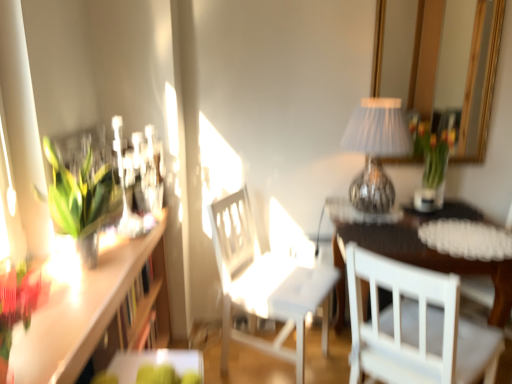
What do you see at coordinates (433, 149) in the screenshot? I see `translucent glass vase with tulips at upper right` at bounding box center [433, 149].

Locate an element on the screen. The height and width of the screenshot is (384, 512). white matte chair at center, the 2th chair in the right-to-left sequence is located at coordinates (265, 284).

In order to face silver pleated lampshade at upper right, should I rotate leftwards or rightwards?

It's best to rotate right around 15.654 degrees.

This screenshot has height=384, width=512. I want to click on wooden shelf at left, so click(91, 311).

The image size is (512, 384). What are the coordinates of `white wooden chair at lower right, the 2th chair viewed from the left` in the screenshot? It's located at pos(415,327).

Where is `translucent glass vase with tulips at upper right`? The height and width of the screenshot is (384, 512). translucent glass vase with tulips at upper right is located at coordinates (433, 149).

From the image's perspective, does white matte chair at center, the 2th chair in the right-to-left sequence, appear lower than green plastic tray at lower center, which is counted as the 2th table, starting from the right?

Actually, white matte chair at center, the 2th chair in the right-to-left sequence, appears above green plastic tray at lower center, which is counted as the 2th table, starting from the right, in the image.

Is white matte chair at center, arranged as the first chair when viewed from the left, aimed at green plastic tray at lower center, the first table positioned from the top?

No, white matte chair at center, arranged as the first chair when viewed from the left, is not facing towards green plastic tray at lower center, the first table positioned from the top.

Considering the sizes of objects white matte chair at center, the 2th chair in the right-to-left sequence, and green plastic tray at lower center, the first table when ordered from left to right, in the image provided, who is wider, white matte chair at center, the 2th chair in the right-to-left sequence, or green plastic tray at lower center, the first table when ordered from left to right,?

white matte chair at center, the 2th chair in the right-to-left sequence, is wider.

Starting from the white matte chair at center, the 2th chair in the right-to-left sequence, which table is the 2nd one in front? Please provide its 2D coordinates.

[(154, 368)]

Can you confirm if white matte chair at center, the 2th chair in the right-to-left sequence, is wider than white wooden chair at lower right, acting as the 1th chair starting from the right?

In fact, white matte chair at center, the 2th chair in the right-to-left sequence, might be narrower than white wooden chair at lower right, acting as the 1th chair starting from the right.

Which of these two, white matte chair at center, the 2th chair in the right-to-left sequence, or white wooden chair at lower right, the 2th chair viewed from the left, is bigger?

Bigger between the two is white matte chair at center, the 2th chair in the right-to-left sequence.

From the image's perspective, would you say white matte chair at center, the 2th chair in the right-to-left sequence, is positioned over white wooden chair at lower right, acting as the 1th chair starting from the right?

Yes, from the image's perspective, white matte chair at center, the 2th chair in the right-to-left sequence, is over white wooden chair at lower right, acting as the 1th chair starting from the right.

Is white matte chair at center, arranged as the first chair when viewed from the left, at the left side of white wooden chair at lower right, the 2th chair viewed from the left?

Yes, white matte chair at center, arranged as the first chair when viewed from the left, is to the left of white wooden chair at lower right, the 2th chair viewed from the left.

Is wooden table at center, the first table in the back-to-front sequence, spatially inside wooden shelf at left, or outside of it?

wooden table at center, the first table in the back-to-front sequence, lies outside wooden shelf at left.

How different are the orientations of wooden table at center, marked as the second table in a top-to-bottom arrangement, and wooden shelf at left in degrees?

There is a 91.8-degree angle between the facing directions of wooden table at center, marked as the second table in a top-to-bottom arrangement, and wooden shelf at left.

Considering the sizes of wooden table at center, positioned as the second table in front-to-back order, and wooden shelf at left in the image, is wooden table at center, positioned as the second table in front-to-back order, bigger or smaller than wooden shelf at left?

wooden table at center, positioned as the second table in front-to-back order, is bigger than wooden shelf at left.

Which object is thinner, wooden table at center, marked as the second table in a top-to-bottom arrangement, or wooden shelf at left?

With smaller width is wooden shelf at left.

From a real-world perspective, between wooden shelf at left and white wooden chair at lower right, acting as the 1th chair starting from the right, who is vertically higher?

In real-world perspective, wooden shelf at left is above.

Is wooden shelf at left to the left or to the right of white wooden chair at lower right, acting as the 1th chair starting from the right, in the image?

From the image, it's evident that wooden shelf at left is to the left of white wooden chair at lower right, acting as the 1th chair starting from the right.

Considering the points (71, 352) and (400, 343), which point is behind, point (71, 352) or point (400, 343)?

Positioned behind is point (400, 343).

Locate an element on the screen. The height and width of the screenshot is (384, 512). counter in front of the white wooden chair at lower right, acting as the 1th chair starting from the right is located at coordinates (91, 311).

Is silver pleated lampshade at upper right outside of white wooden chair at lower right, acting as the 1th chair starting from the right?

silver pleated lampshade at upper right is positioned outside white wooden chair at lower right, acting as the 1th chair starting from the right.

At what (x,y) coordinates should I click in order to perform the action: click on table lamp above the white wooden chair at lower right, the 2th chair viewed from the left (from a real-world perspective). Please return your answer as a coordinate pair (x, y). Looking at the image, I should click on (376, 151).

Could you tell me if silver pleated lampshade at upper right is facing white wooden chair at lower right, acting as the 1th chair starting from the right?

No, silver pleated lampshade at upper right is not turned towards white wooden chair at lower right, acting as the 1th chair starting from the right.

Is translucent glass vase with tulips at upper right to the left of wooden shelf at left from the viewer's perspective?

No.

From a real-world perspective, between translucent glass vase with tulips at upper right and wooden shelf at left, who is vertically higher?

translucent glass vase with tulips at upper right.

The image size is (512, 384). Find the location of `counter on the left of translucent glass vase with tulips at upper right`. counter on the left of translucent glass vase with tulips at upper right is located at coordinates (91, 311).

In terms of height, does translucent glass vase with tulips at upper right look taller or shorter compared to wooden shelf at left?

In the image, translucent glass vase with tulips at upper right appears to be taller than wooden shelf at left.

Is white wooden chair at lower right, the 2th chair viewed from the left, inside or outside of green leafy plant at left?

white wooden chair at lower right, the 2th chair viewed from the left, exists outside the volume of green leafy plant at left.

Is white wooden chair at lower right, acting as the 1th chair starting from the right, next to green leafy plant at left and touching it?

No, white wooden chair at lower right, acting as the 1th chair starting from the right, is not in contact with green leafy plant at left.

In the scene shown: Which object is positioned more to the left, white wooden chair at lower right, acting as the 1th chair starting from the right, or green leafy plant at left?

green leafy plant at left is more to the left.

Locate an element on the screen. the 2nd table in front of the white matte chair at center, the 2th chair in the right-to-left sequence, counting from the anchor's position is located at coordinates (154, 368).

Find the location of `chair located underneath the white wooden chair at lower right, acting as the 1th chair starting from the right (from a real-world perspective)`. chair located underneath the white wooden chair at lower right, acting as the 1th chair starting from the right (from a real-world perspective) is located at coordinates (265, 284).

From the image, which object appears to be nearer to wooden table at center, positioned as the second table in front-to-back order, white matte chair at center, the 2th chair in the right-to-left sequence, or white wooden chair at lower right, acting as the 1th chair starting from the right?

The object closer to wooden table at center, positioned as the second table in front-to-back order, is white wooden chair at lower right, acting as the 1th chair starting from the right.

Based on their spatial positions, is white matte chair at center, the 2th chair in the right-to-left sequence, or green plastic tray at lower center, the first table positioned from the top, further from green leafy plant at left?

white matte chair at center, the 2th chair in the right-to-left sequence, is further to green leafy plant at left.

Based on their spatial positions, is green leafy plant at left or white wooden chair at lower right, the 2th chair viewed from the left, further from green plastic tray at lower center, the 1th table positioned from the front?

white wooden chair at lower right, the 2th chair viewed from the left, lies further to green plastic tray at lower center, the 1th table positioned from the front, than the other object.

When comparing their distances from wooden table at center, marked as the second table in a top-to-bottom arrangement, does wooden shelf at left or silver pleated lampshade at upper right seem closer?

The object closer to wooden table at center, marked as the second table in a top-to-bottom arrangement, is silver pleated lampshade at upper right.

Which object lies nearer to the anchor point translucent glass vase with tulips at upper right, green plastic tray at lower center, which ranks as the 2th table in bottom-to-top order, or silver pleated lampshade at upper right?

The object closer to translucent glass vase with tulips at upper right is silver pleated lampshade at upper right.

Estimate the real-world distances between objects in this image. Which object is further from white wooden chair at lower right, acting as the 1th chair starting from the right, silver pleated lampshade at upper right or white matte chair at center, the 2th chair in the right-to-left sequence?

silver pleated lampshade at upper right is positioned further to the anchor white wooden chair at lower right, acting as the 1th chair starting from the right.

Which object lies nearer to the anchor point wooden table at center, which appears as the 1th table when viewed from the right, translucent glass vase with tulips at upper right or green plastic tray at lower center, the first table positioned from the top?

Among the two, translucent glass vase with tulips at upper right is located nearer to wooden table at center, which appears as the 1th table when viewed from the right.

Looking at the image, which one is located further to white matte chair at center, arranged as the first chair when viewed from the left, wooden shelf at left or silver pleated lampshade at upper right?

wooden shelf at left is further to white matte chair at center, arranged as the first chair when viewed from the left.

Where is `floral arrangement between silver pleated lampshade at upper right and wooden table at center, the second table in the left-to-right sequence, vertically`? The height and width of the screenshot is (384, 512). floral arrangement between silver pleated lampshade at upper right and wooden table at center, the second table in the left-to-right sequence, vertically is located at coordinates (433, 149).

Find the location of a particular element. counter between green leafy plant at left and green plastic tray at lower center, the first table positioned from the top, in the vertical direction is located at coordinates (91, 311).

Locate an element on the screen. This screenshot has width=512, height=384. chair located between wooden shelf at left and silver pleated lampshade at upper right in the left-right direction is located at coordinates (265, 284).

Where is `table lamp situated between wooden shelf at left and white wooden chair at lower right, the 2th chair viewed from the left, from left to right`? Image resolution: width=512 pixels, height=384 pixels. table lamp situated between wooden shelf at left and white wooden chair at lower right, the 2th chair viewed from the left, from left to right is located at coordinates (376, 151).